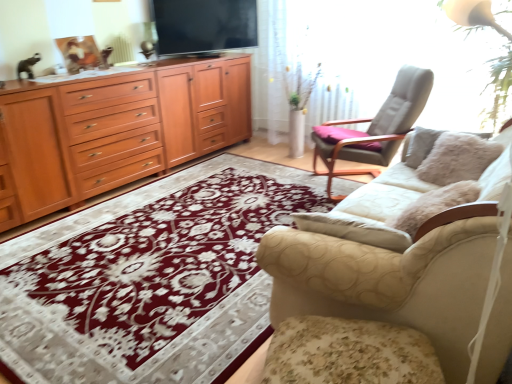
Question: Considering the positions of wooden drawer at left and light gray fabric chair at upper right in the image, is wooden drawer at left bigger or smaller than light gray fabric chair at upper right?

Choices:
 (A) small
 (B) big

Answer: (A)

Question: From the image's perspective, is wooden drawer at left positioned above or below light gray fabric chair at upper right?

Choices:
 (A) below
 (B) above

Answer: (B)

Question: Which object is the farthest from the beige fabric couch at right?

Choices:
 (A) floral fabric footrest at lower right
 (B) light gray fabric chair at upper right
 (C) floral carpet at center
 (D) flat screen tv at upper center
 (E) wooden cabinet at left

Answer: (D)

Question: Estimate the real-world distances between objects in this image. Which object is closer to the light gray fabric chair at upper right?

Choices:
 (A) wooden drawer at left
 (B) beige fabric couch at right
 (C) floral fabric footrest at lower right
 (D) wooden cabinet at left
 (E) floral carpet at center

Answer: (E)